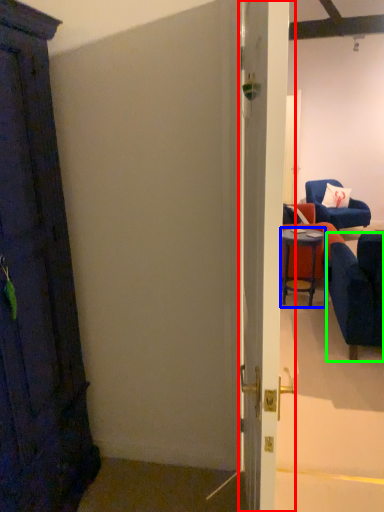
Question: Which object is positioned farthest from door (highlighted by a red box)? Select from table (highlighted by a blue box) and chair (highlighted by a green box).

Choices:
 (A) table
 (B) chair

Answer: (A)